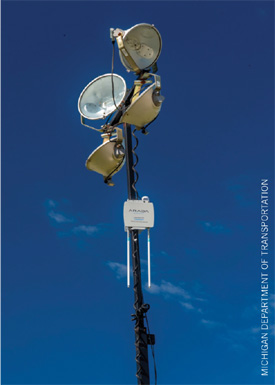
At what (x,y) coordinates should I click in order to perform the action: click on spot lights. Please return your answer as a coordinate pair (x, y). This screenshot has height=385, width=275. Looking at the image, I should click on click(x=135, y=51), click(x=105, y=104), click(x=140, y=106), click(x=106, y=145), click(x=171, y=49).